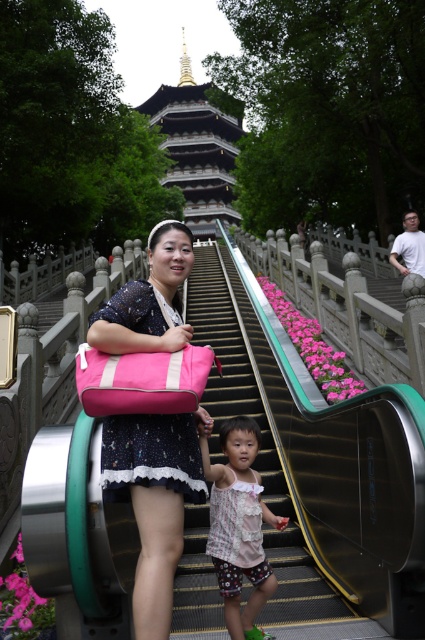
Describe the element at coordinates (258, 451) in the screenshot. I see `metallic escalator at center` at that location.

Is point (204, 330) behind point (257, 580)?

That is True.

Who is more forward, (232, 307) or (243, 496)?

Point (243, 496) is more forward.

Identify the location of metallic escalator at center. (258, 451).

Who is lower down, pink fabric bag at center or metallic escalator at center?

pink fabric bag at center is lower down.

Does point (149, 580) lie in front of point (183, 612)?

That is True.

Is point (115, 452) closer to viewer compared to point (302, 616)?

That is True.

You are a GUI agent. You are given a task and a screenshot of the screen. Output one action in this format:
    pyautogui.click(x=<x>, y=<y>)
    Task: Click on the pink fabric bag at center
    
    Given the screenshot: What is the action you would take?
    pyautogui.click(x=155, y=500)

Is pink fabric bag at center thinner than gold-painted wooden pagoda at upper center?

Indeed, pink fabric bag at center has a lesser width compared to gold-painted wooden pagoda at upper center.

Which is more to the left, pink fabric bag at center or gold-painted wooden pagoda at upper center?

From the viewer's perspective, gold-painted wooden pagoda at upper center appears more on the left side.

Is point (169, 241) behind point (238, 218)?

No, (169, 241) is in front of (238, 218).

Image resolution: width=425 pixels, height=640 pixels. In order to click on pink fabric bag at center in this screenshot , I will do `click(155, 500)`.